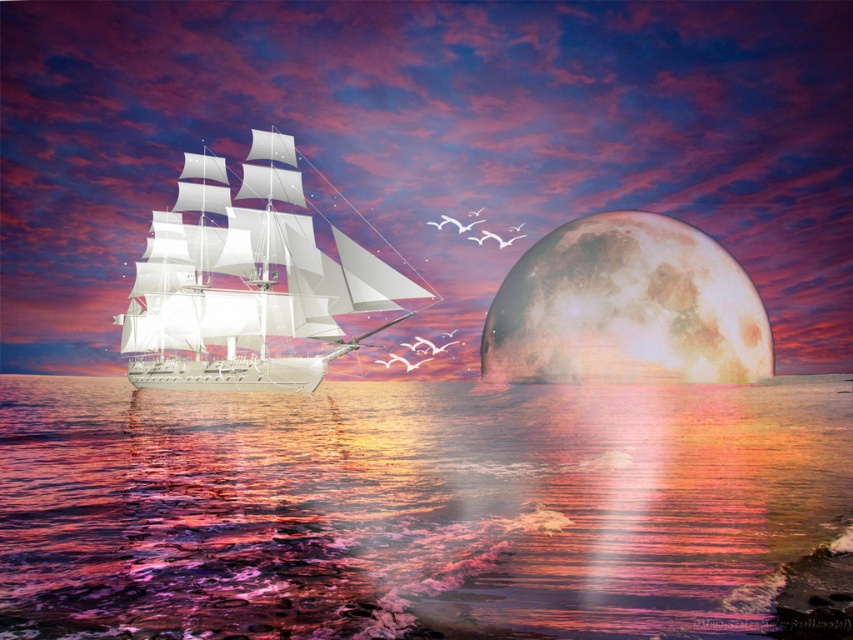
Question: Considering the relative positions of shiny metallic water at lower center and rustic textured moon at right in the image provided, where is shiny metallic water at lower center located with respect to rustic textured moon at right?

Choices:
 (A) left
 (B) right

Answer: (A)

Question: Does white glossy sailboat at left appear over rustic textured moon at right?

Choices:
 (A) yes
 (B) no

Answer: (A)

Question: Is shiny metallic water at lower center to the right of rustic textured moon at right from the viewer's perspective?

Choices:
 (A) no
 (B) yes

Answer: (A)

Question: Which object is the closest to the white glossy sailboat at left?

Choices:
 (A) shiny metallic water at lower center
 (B) rustic textured moon at right

Answer: (A)

Question: Among these points, which one is nearest to the camera?

Choices:
 (A) (668, 496)
 (B) (281, 220)

Answer: (A)

Question: Which object is closer to the camera taking this photo?

Choices:
 (A) rustic textured moon at right
 (B) shiny metallic water at lower center

Answer: (B)